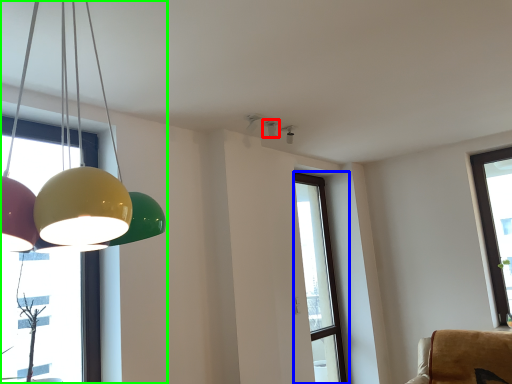
Question: Which object is positioned farthest from lamp (highlighted by a red box)? Select from window (highlighted by a blue box) and lamp (highlighted by a green box).

Choices:
 (A) window
 (B) lamp

Answer: (B)